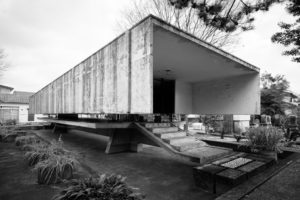
Where is `five steps on stairs`? This screenshot has height=200, width=300. five steps on stairs is located at coordinates [x=190, y=146].